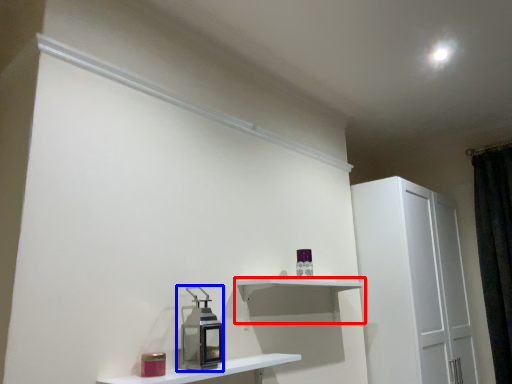
Question: Which object appears closest to the camera in this image, shelf (highlighted by a red box) or appliance (highlighted by a blue box)?

Choices:
 (A) shelf
 (B) appliance

Answer: (B)